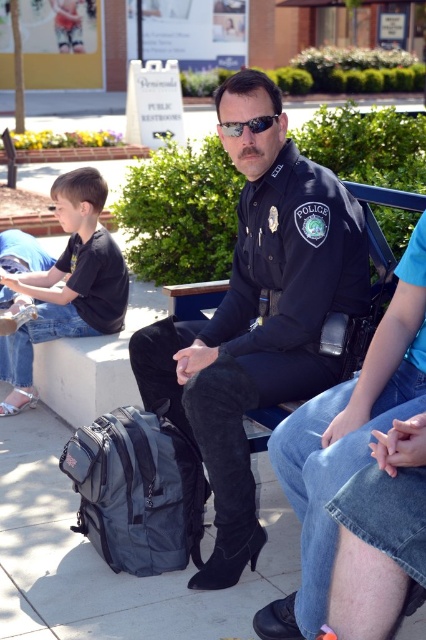
Can you confirm if dark blue uniform at center is wider than black reflective sunglasses at center?

Indeed, dark blue uniform at center has a greater width compared to black reflective sunglasses at center.

I want to click on dark blue uniform at center, so click(258, 316).

You are a GUI agent. You are given a task and a screenshot of the screen. Output one action in this format:
    pyautogui.click(x=<x>, y=<y>)
    Task: Click on the dark blue uniform at center
    
    Given the screenshot: What is the action you would take?
    pyautogui.click(x=258, y=316)

Which is below, black matte shirt at left or black reflective sunglasses at center?

black matte shirt at left is below.

Is black matte shirt at left thinner than black reflective sunglasses at center?

No, black matte shirt at left is not thinner than black reflective sunglasses at center.

Measure the distance between black matte shirt at left and camera.

13.88 feet

Where is `black matte shirt at left`? The image size is (426, 640). black matte shirt at left is located at coordinates (68, 284).

Image resolution: width=426 pixels, height=640 pixels. What do you see at coordinates (258, 316) in the screenshot?
I see `dark blue uniform at center` at bounding box center [258, 316].

You are a GUI agent. You are given a task and a screenshot of the screen. Output one action in this format:
    pyautogui.click(x=<x>, y=<y>)
    Task: Click on the dark blue uniform at center
    
    Given the screenshot: What is the action you would take?
    pyautogui.click(x=258, y=316)